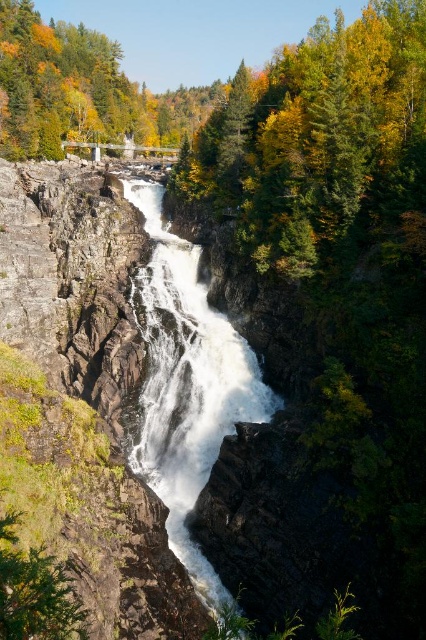
In the scene shown: Does green leafy tree at upper center have a lesser width compared to white frothy water at center?

Incorrect, green leafy tree at upper center's width is not less than white frothy water at center's.

Between green leafy tree at upper center and white frothy water at center, which one has more height?

green leafy tree at upper center is taller.

Find the location of a particular element. The height and width of the screenshot is (640, 426). green leafy tree at upper center is located at coordinates (319, 140).